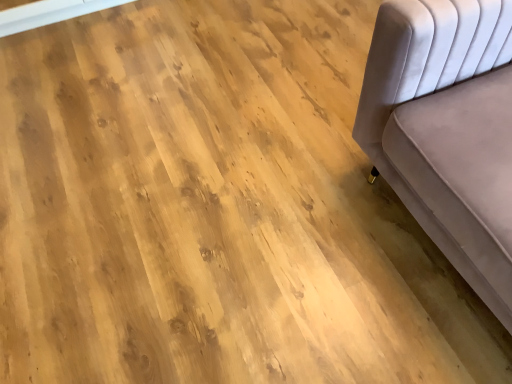
This screenshot has width=512, height=384. Find the location of `vacant space positioned to the left of suede-like gray couch at right`. vacant space positioned to the left of suede-like gray couch at right is located at coordinates (281, 230).